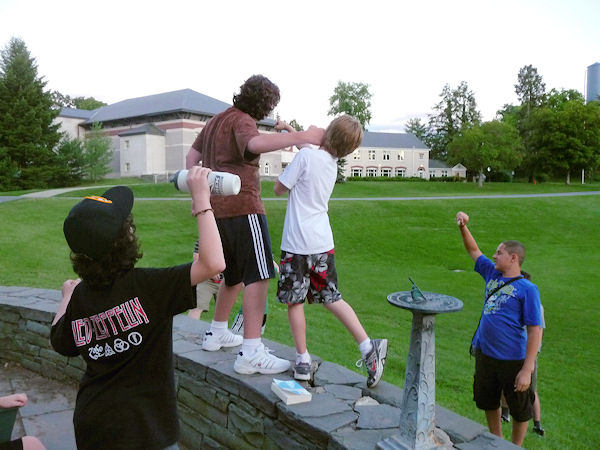
Identify the location of book. (287, 390).